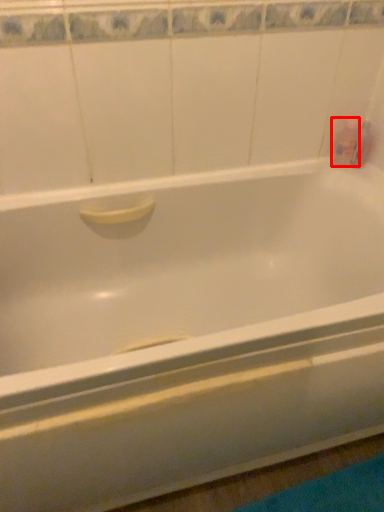
Question: From the image's perspective, considering the relative positions of toiletry (annotated by the red box) and toiletry in the image provided, where is toiletry (annotated by the red box) located with respect to the staircase?

Choices:
 (A) above
 (B) below

Answer: (B)